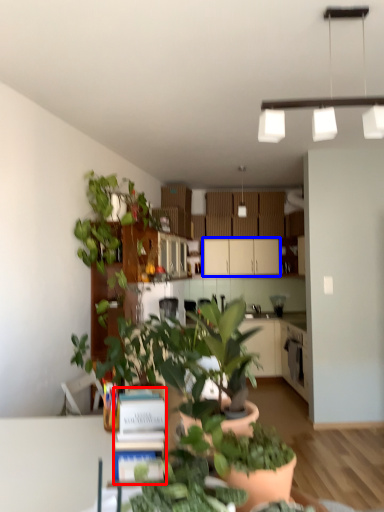
Question: Which object is further to the camera taking this photo, book (highlighted by a red box) or cabinetry (highlighted by a blue box)?

Choices:
 (A) book
 (B) cabinetry

Answer: (B)